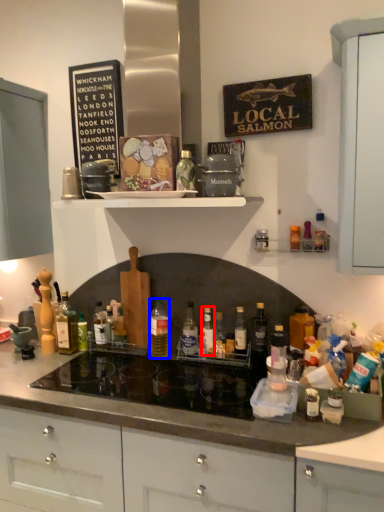
Question: Which point is further to the camera, bottle (highlighted by a red box) or bottle (highlighted by a blue box)?

Choices:
 (A) bottle
 (B) bottle

Answer: (B)